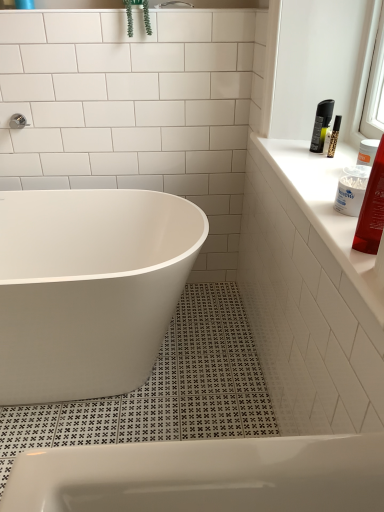
In order to face white plastic cotton swab container at upper right, should I rotate leftwards or rightwards?

It's best to rotate right around 21.459 degrees.

What do you see at coordinates (89, 288) in the screenshot? Image resolution: width=384 pixels, height=512 pixels. I see `white glossy bathtub at center` at bounding box center [89, 288].

Find the location of a particular element. The width and height of the screenshot is (384, 512). green leafy plant at upper center is located at coordinates (132, 18).

What do you see at coordinates (372, 208) in the screenshot? I see `shiny red plastic tube at upper right` at bounding box center [372, 208].

The width and height of the screenshot is (384, 512). I want to click on white plastic cotton swab container at upper right, so click(351, 189).

Considering the relative positions of white glossy countertop at upper right and green leafy plant at upper center in the image provided, is white glossy countertop at upper right to the right of green leafy plant at upper center from the viewer's perspective?

Yes.

Is point (344, 224) closer or farther from the camera than point (137, 1)?

Point (344, 224).

Is white glossy countertop at upper right oriented away from green leafy plant at upper center?

white glossy countertop at upper right does not have its back to green leafy plant at upper center.

Does white glossy countertop at upper right touch green leafy plant at upper center?

No, white glossy countertop at upper right is not touching green leafy plant at upper center.

From the image's perspective, does white glossy bathtub at center appear higher than white glossy countertop at upper right?

Incorrect, from the image's perspective, white glossy bathtub at center is lower than white glossy countertop at upper right.

From their relative heights in the image, would you say white glossy bathtub at center is taller or shorter than white glossy countertop at upper right?

Clearly, white glossy bathtub at center is taller compared to white glossy countertop at upper right.

What's the angular difference between white glossy bathtub at center and white glossy countertop at upper right's facing directions?

There is a 89.8-degree angle between the facing directions of white glossy bathtub at center and white glossy countertop at upper right.

Locate an element on the screen. bathtub lying behind the white glossy countertop at upper right is located at coordinates (89, 288).

From the picture: Which object is thinner, white glossy bathtub at center or shiny red plastic tube at upper right?

Thinner between the two is shiny red plastic tube at upper right.

You are a GUI agent. You are given a task and a screenshot of the screen. Output one action in this format:
    pyautogui.click(x=<x>, y=<y>)
    Task: Click on the bathtub on the left of shiny red plastic tube at upper right
    The height and width of the screenshot is (512, 384).
    Given the screenshot: What is the action you would take?
    pyautogui.click(x=89, y=288)

Could you tell me if white glossy bathtub at center is facing shiny red plastic tube at upper right?

No, white glossy bathtub at center is not facing towards shiny red plastic tube at upper right.

Is white glossy countertop at upper right facing towards shiny red plastic tube at upper right?

No, white glossy countertop at upper right is not aimed at shiny red plastic tube at upper right.

Considering the positions of objects white glossy countertop at upper right and shiny red plastic tube at upper right in the image provided, who is more to the right, white glossy countertop at upper right or shiny red plastic tube at upper right?

white glossy countertop at upper right.

Is white glossy countertop at upper right in front of or behind shiny red plastic tube at upper right in the image?

Clearly, white glossy countertop at upper right is in front of shiny red plastic tube at upper right.

Looking at the image, does shiny red plastic tube at upper right seem bigger or smaller compared to green leafy plant at upper center?

Clearly, shiny red plastic tube at upper right is smaller in size than green leafy plant at upper center.

Is shiny red plastic tube at upper right oriented away from green leafy plant at upper center?

No, shiny red plastic tube at upper right is not facing away from green leafy plant at upper center.

Considering the sizes of objects shiny red plastic tube at upper right and green leafy plant at upper center in the image provided, who is thinner, shiny red plastic tube at upper right or green leafy plant at upper center?

shiny red plastic tube at upper right is thinner.

From the image's perspective, between shiny red plastic tube at upper right and green leafy plant at upper center, which one is located above?

green leafy plant at upper center is shown above in the image.

Is point (370, 241) more distant than point (356, 225)?

That is False.

Is shiny red plastic tube at upper right situated inside white glossy countertop at upper right or outside?

shiny red plastic tube at upper right is spatially situated outside white glossy countertop at upper right.

From the picture: Between shiny red plastic tube at upper right and white glossy countertop at upper right, which one appears on the left side from the viewer's perspective?

shiny red plastic tube at upper right.

Which of these two, shiny red plastic tube at upper right or white glossy countertop at upper right, is thinner?

Thinner between the two is shiny red plastic tube at upper right.

Is white glossy bathtub at center wider or thinner than green leafy plant at upper center?

In the image, white glossy bathtub at center appears to be wider than green leafy plant at upper center.

From the image's perspective, is white glossy bathtub at center positioned above or below green leafy plant at upper center?

Based on their image positions, white glossy bathtub at center is located beneath green leafy plant at upper center.

How far apart are white glossy bathtub at center and green leafy plant at upper center?

36.99 inches.

Can you tell me how much white glossy bathtub at center and green leafy plant at upper center differ in facing direction?

0.916 degrees separate the facing orientations of white glossy bathtub at center and green leafy plant at upper center.

At what (x,y) coordinates should I click in order to perform the action: click on window sill that is under the green leafy plant at upper center (from a real-world perspective). Please return your answer as a coordinate pair (x, y). The width and height of the screenshot is (384, 512). Looking at the image, I should click on (326, 211).

Image resolution: width=384 pixels, height=512 pixels. What are the coordinates of `window sill located in front of the white glossy bathtub at center` in the screenshot? It's located at (326, 211).

When comparing their distances from white plastic cotton swab container at upper right, does shiny red plastic tube at upper right or white glossy countertop at upper right seem further?

Based on the image, white glossy countertop at upper right appears to be further to white plastic cotton swab container at upper right.

Estimate the real-world distances between objects in this image. Which object is closer to green leafy plant at upper center, shiny red plastic tube at upper right or white glossy countertop at upper right?

Based on the image, white glossy countertop at upper right appears to be nearer to green leafy plant at upper center.

When comparing their distances from white plastic cotton swab container at upper right, does green leafy plant at upper center or white glossy bathtub at center seem closer?

Among the two, white glossy bathtub at center is located nearer to white plastic cotton swab container at upper right.

Estimate the real-world distances between objects in this image. Which object is further from green leafy plant at upper center, white glossy countertop at upper right or white plastic cotton swab container at upper right?

Based on the image, white plastic cotton swab container at upper right appears to be further to green leafy plant at upper center.

In the scene shown: From the image, which object appears to be farther from white glossy bathtub at center, shiny red plastic tube at upper right or green leafy plant at upper center?

Among the two, shiny red plastic tube at upper right is located further to white glossy bathtub at center.

Estimate the real-world distances between objects in this image. Which object is closer to white glossy bathtub at center, white glossy countertop at upper right or white plastic cotton swab container at upper right?

white glossy countertop at upper right.

Based on their spatial positions, is green leafy plant at upper center or white plastic cotton swab container at upper right closer to white glossy countertop at upper right?

Based on the image, white plastic cotton swab container at upper right appears to be nearer to white glossy countertop at upper right.

Based on their spatial positions, is shiny red plastic tube at upper right or white glossy countertop at upper right closer to white glossy bathtub at center?

The object closer to white glossy bathtub at center is white glossy countertop at upper right.

I want to click on window sill between green leafy plant at upper center and white plastic cotton swab container at upper right in the up-down direction, so click(326, 211).

At what (x,y) coordinates should I click in order to perform the action: click on toiletry situated between white glossy bathtub at center and white glossy countertop at upper right from left to right. Please return your answer as a coordinate pair (x, y). This screenshot has width=384, height=512. Looking at the image, I should click on (372, 208).

You are a GUI agent. You are given a task and a screenshot of the screen. Output one action in this format:
    pyautogui.click(x=<x>, y=<y>)
    Task: Click on the cleaning product that lies between green leafy plant at upper center and white glossy bathtub at center from top to bottom
    
    Given the screenshot: What is the action you would take?
    pyautogui.click(x=351, y=189)

You are a GUI agent. You are given a task and a screenshot of the screen. Output one action in this format:
    pyautogui.click(x=<x>, y=<y>)
    Task: Click on the cleaning product between green leafy plant at upper center and shiny red plastic tube at upper right vertically
    This screenshot has height=512, width=384.
    Given the screenshot: What is the action you would take?
    pyautogui.click(x=351, y=189)